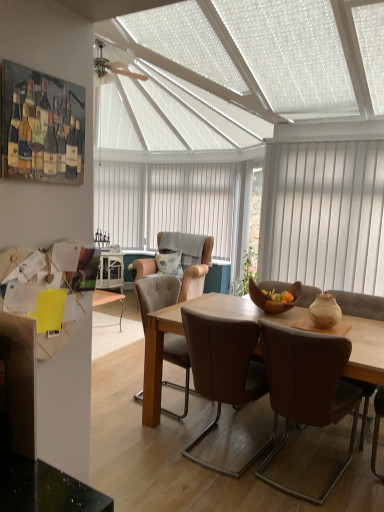
Question: Choose the correct answer: Is white wood blinds at right inside fluffy fabric pillow at center or outside it?

Choices:
 (A) outside
 (B) inside

Answer: (A)

Question: Looking at their shapes, would you say white wood blinds at right is wider or thinner than fluffy fabric pillow at center?

Choices:
 (A) thin
 (B) wide

Answer: (A)

Question: Which is farther from the leather armchair at center, arranged as the 1th chair when viewed from the back?

Choices:
 (A) wooden table at center
 (B) white glossy table at center
 (C) white vertical blinds at center
 (D) brown leather chair at center, the 2th chair viewed from the back
 (E) brown leather chair at center, the fourth chair in the back-to-front sequence

Answer: (C)

Question: Which object is the farthest from the white wood blinds at right?

Choices:
 (A) leather armchair at center, which is counted as the fourth chair, starting from the front
 (B) brown leather chair at center, the fourth chair in the back-to-front sequence
 (C) white vertical blinds at center
 (D) brown leather chair at center, acting as the 3th chair starting from the back
 (E) wooden table at center

Answer: (C)